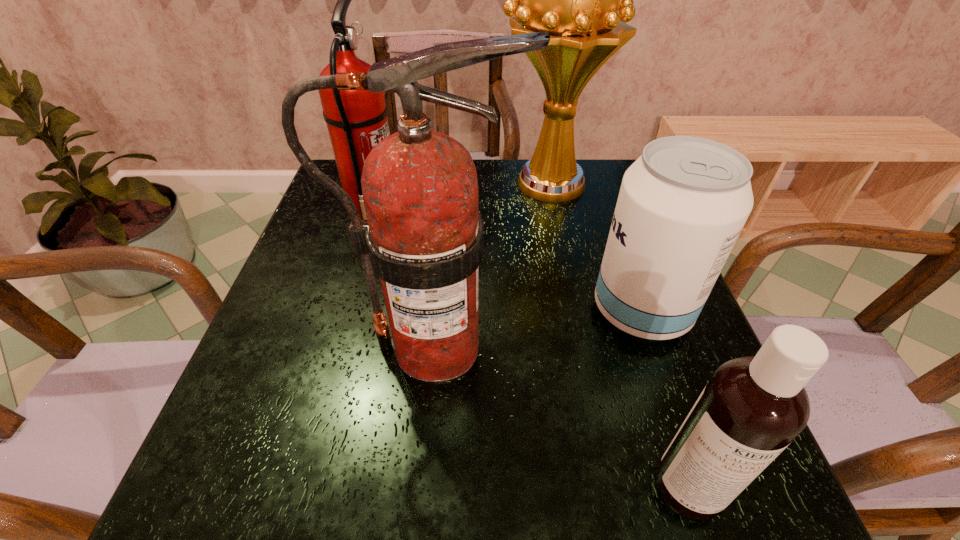
Image resolution: width=960 pixels, height=540 pixels. Find the location of `object at the near right corner`. object at the near right corner is located at coordinates (753, 407).

The width and height of the screenshot is (960, 540). Identify the location of vacant space at the far edge of the desktop. point(492,204).

In the image, there is a desktop. Where is `vacant space at the near edge`? vacant space at the near edge is located at coordinates (531, 497).

Locate an element on the screen. free space at the left edge of the desktop is located at coordinates (218, 418).

This screenshot has width=960, height=540. I want to click on vacant space at the right edge of the desktop, so click(x=593, y=215).

The height and width of the screenshot is (540, 960). I want to click on vacant space at the far left corner of the desktop, so click(324, 203).

Where is `free area in between the farther fire extinguisher and the alcohol`? Image resolution: width=960 pixels, height=540 pixels. free area in between the farther fire extinguisher and the alcohol is located at coordinates pyautogui.click(x=508, y=261).

The image size is (960, 540). What are the coordinates of `vacant point located between the trophy_cup and the alcohol` in the screenshot? It's located at (594, 247).

This screenshot has height=540, width=960. Identify the location of unoccupied area between the dishwasher detergent and the alcohol. (665, 399).

Locate an element on the screen. free space between the dishwasher detergent and the alcohol is located at coordinates (665, 399).